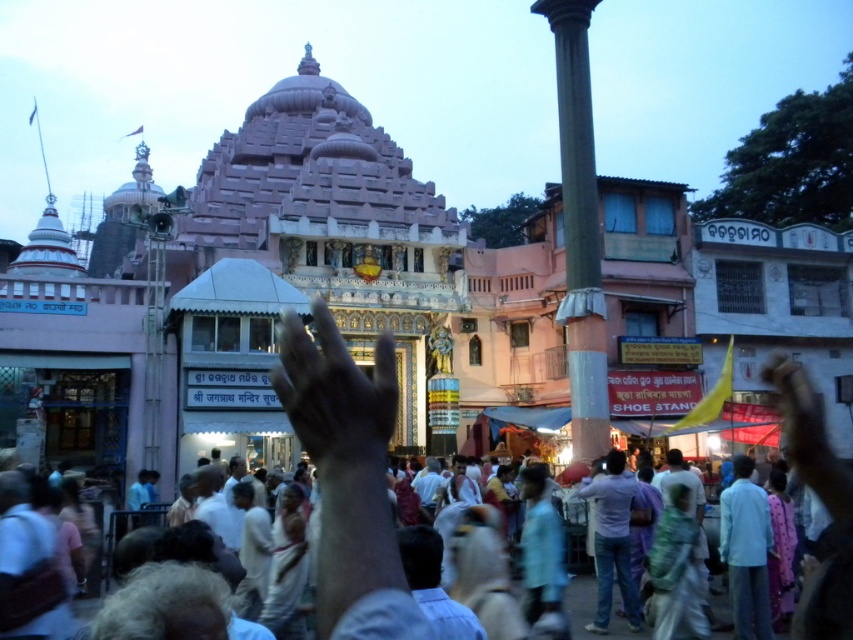
Is smooth gray column at center wider than matte skin hand at lower right?

No.

Which is below, smooth gray column at center or matte skin hand at lower right?

matte skin hand at lower right is below.

The height and width of the screenshot is (640, 853). Identify the location of smooth gray column at center. (579, 228).

What do you see at coordinates (579, 228) in the screenshot? The width and height of the screenshot is (853, 640). I see `smooth gray column at center` at bounding box center [579, 228].

In the scene shown: Who is lower down, smooth gray column at center or black matte hand at center?

black matte hand at center is lower down.

Where is `smooth gray column at center`? Image resolution: width=853 pixels, height=640 pixels. smooth gray column at center is located at coordinates click(x=579, y=228).

Does smooth gray column at center appear under white cotton clothing at center?

Incorrect, smooth gray column at center is not positioned below white cotton clothing at center.

Is the position of smooth gray column at center more distant than that of white cotton clothing at center?

Yes, it is.

Is point (572, 45) closer to viewer compared to point (376, 632)?

No, (572, 45) is behind (376, 632).

Where is `smooth gray column at center`? This screenshot has width=853, height=640. smooth gray column at center is located at coordinates (579, 228).